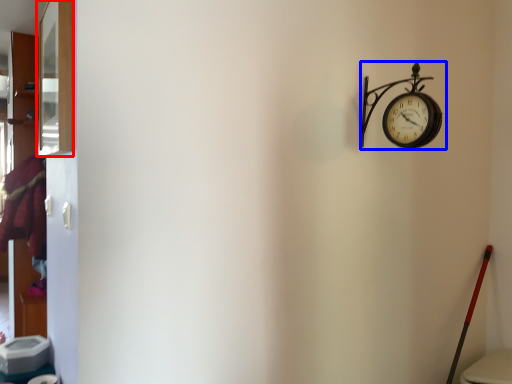
Question: Which object is closer to the camera taking this photo, window (highlighted by a red box) or wall clock (highlighted by a blue box)?

Choices:
 (A) window
 (B) wall clock

Answer: (A)